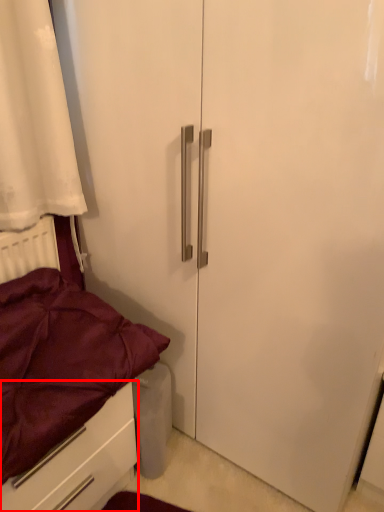
Question: Observing the image, what is the correct spatial positioning of drawer (annotated by the red box) in reference to bed?

Choices:
 (A) right
 (B) left

Answer: (B)